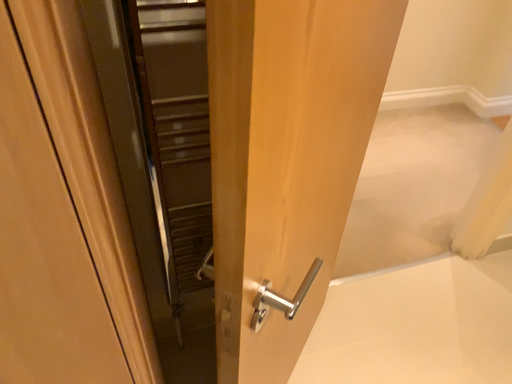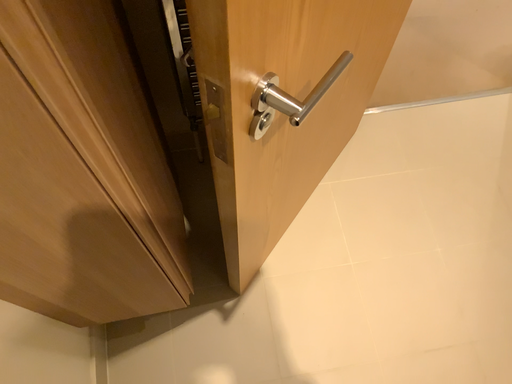
Question: How did the camera likely rotate when shooting the video?

Choices:
 (A) rotated downward
 (B) rotated upward

Answer: (A)